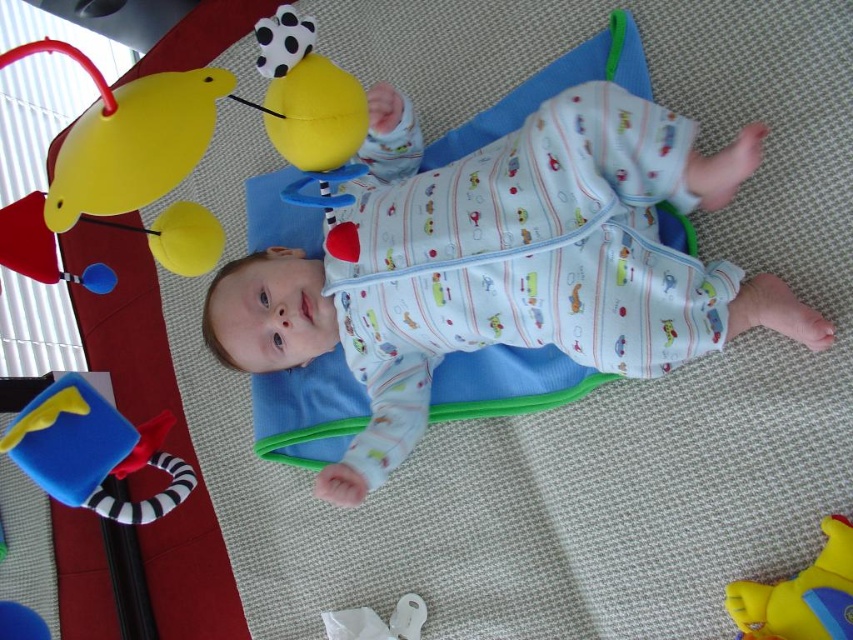
Who is more forward, [175,88] or [780,602]?

Point [175,88]

Which is more to the right, matte yellow duck at upper left or yellow rubber duck at upper left?

yellow rubber duck at upper left

In order to click on matte yellow duck at upper left in this screenshot , I will do (134, 145).

Can you confirm if white cotton onesie at center is positioned below matte yellow duck at upper left?

Yes, white cotton onesie at center is below matte yellow duck at upper left.

In the scene shown: Who is positioned more to the left, white cotton onesie at center or matte yellow duck at upper left?

Positioned to the left is matte yellow duck at upper left.

Where is `white cotton onesie at center`? This screenshot has width=853, height=640. white cotton onesie at center is located at coordinates (505, 264).

The image size is (853, 640). In order to click on white cotton onesie at center in this screenshot , I will do `click(505, 264)`.

Can you confirm if white cotton onesie at center is smaller than yellow rubber duck at upper left?

Incorrect, white cotton onesie at center is not smaller in size than yellow rubber duck at upper left.

What do you see at coordinates (505, 264) in the screenshot?
I see `white cotton onesie at center` at bounding box center [505, 264].

At what (x,y) coordinates should I click in order to perform the action: click on white cotton onesie at center. Please return your answer as a coordinate pair (x, y). This screenshot has height=640, width=853. Looking at the image, I should click on (505, 264).